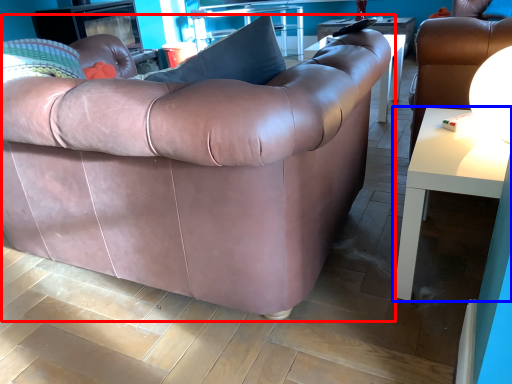
Question: Which point is closer to the camera, studio couch (highlighted by a red box) or table (highlighted by a blue box)?

Choices:
 (A) studio couch
 (B) table

Answer: (A)